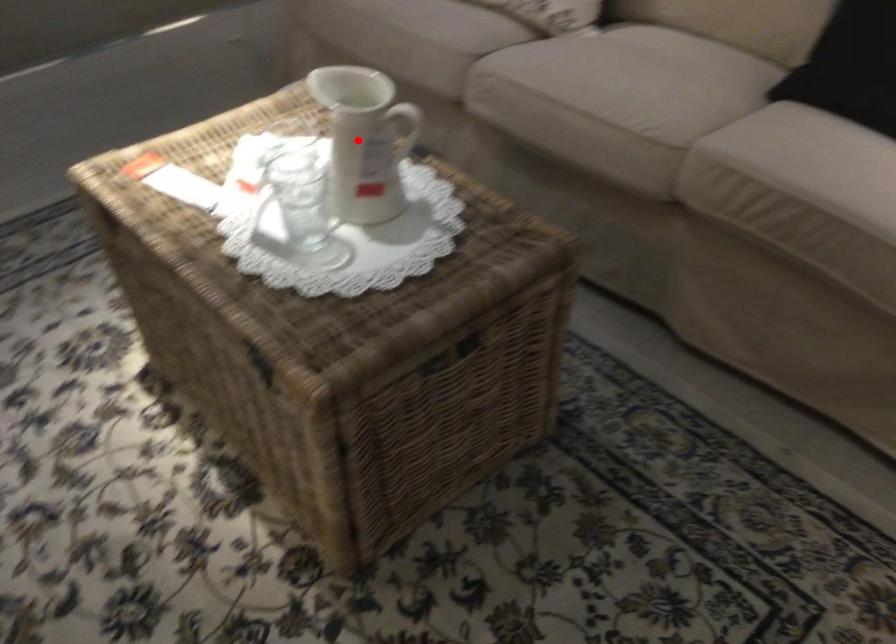
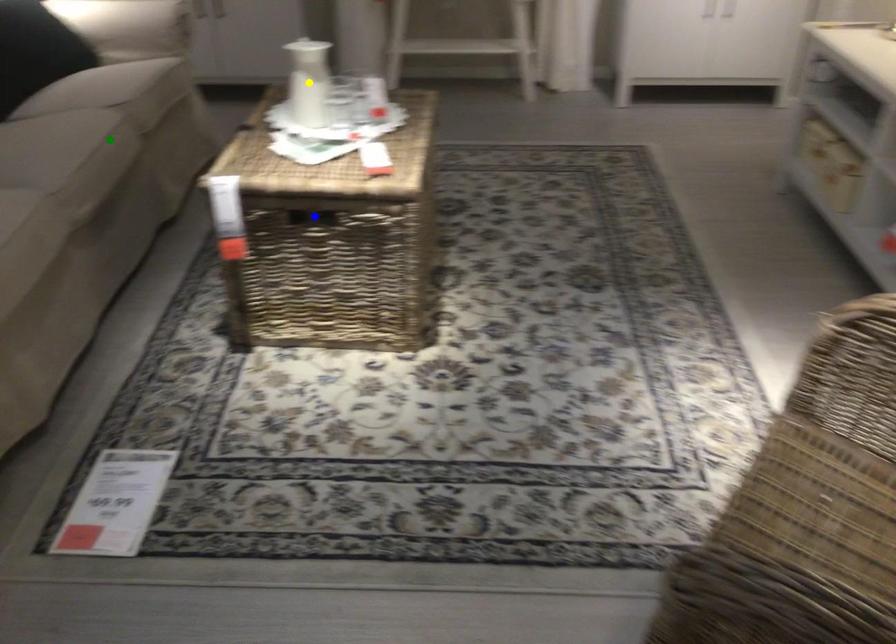
Question: I am providing you with two images of the same scene from different viewpoints. A red point is marked on the first image. You are given multiple points on the second image. Which mark in image 2 goes with the point in image 1?

Choices:
 (A) yellow point
 (B) blue point
 (C) green point

Answer: (A)